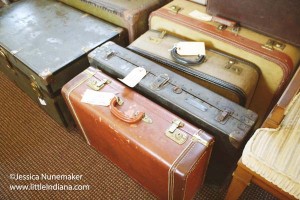
I want to click on handles, so click(x=227, y=21), click(x=184, y=60), click(x=123, y=117).